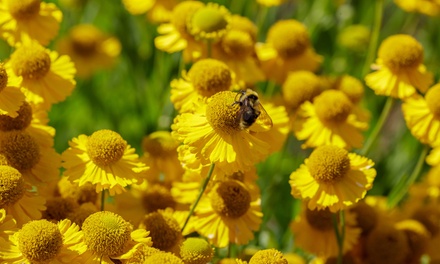
This screenshot has width=440, height=264. Identify the location of plant most to the left of. (2, 76).